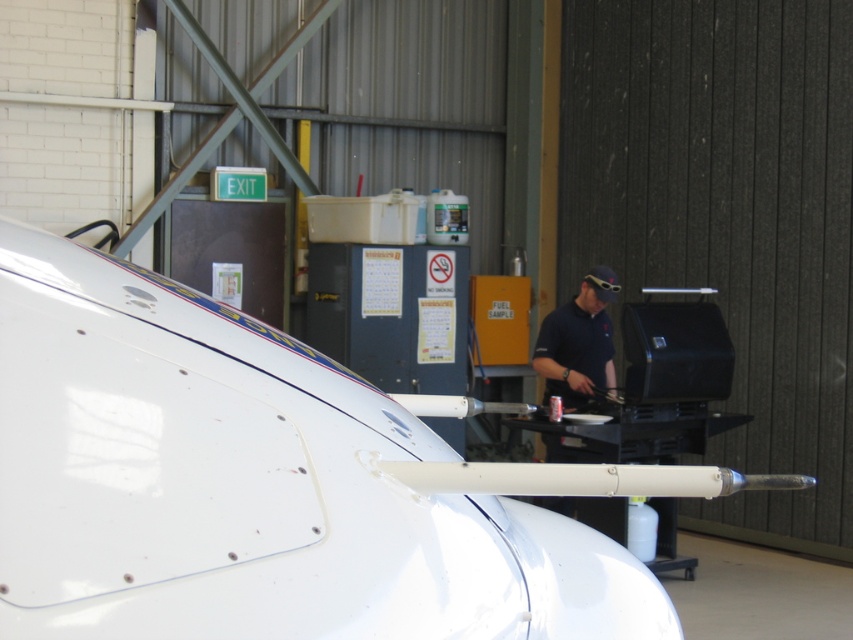
Which of these two, white glossy airplane at center or dark blue shirt at center, stands taller?

With more height is dark blue shirt at center.

Image resolution: width=853 pixels, height=640 pixels. Find the location of `white glossy airplane at center`. white glossy airplane at center is located at coordinates (271, 483).

Find the location of `white glossy airplane at center`. white glossy airplane at center is located at coordinates [271, 483].